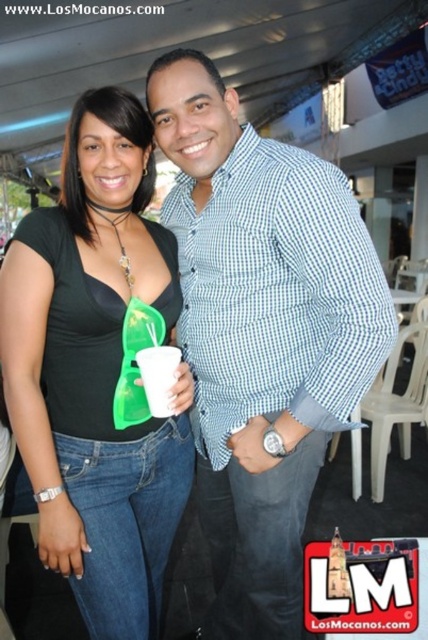
Can you confirm if black matte top at center is thinner than white paper cup at center?

No, black matte top at center is not thinner than white paper cup at center.

How distant is black matte top at center from white paper cup at center?

The distance of black matte top at center from white paper cup at center is 11.23 inches.

Who is more forward, (36, 461) or (145, 371)?

Point (36, 461) is more forward.

Find the location of a particular element. This screenshot has width=428, height=640. black matte top at center is located at coordinates [x=95, y=371].

Is point (306, 218) positioned after point (151, 353)?

No, (306, 218) is closer to viewer.

I want to click on blue checkered shirt at center, so point(261,332).

Where is `blue checkered shirt at center`? The image size is (428, 640). blue checkered shirt at center is located at coordinates (261, 332).

Who is higher up, blue checkered shirt at center or black matte top at center?

Positioned higher is blue checkered shirt at center.

The image size is (428, 640). Identify the location of blue checkered shirt at center. (261, 332).